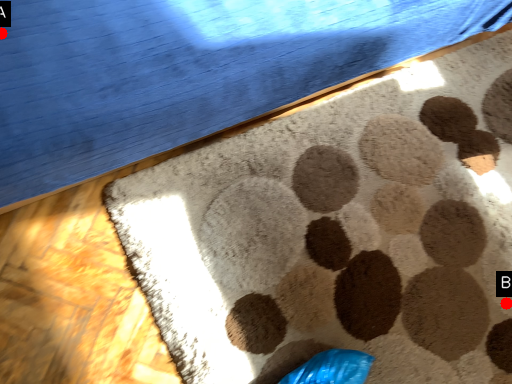
Question: Two points are circled on the image, labeled by A and B beside each circle. Which point is closer to the camera?

Choices:
 (A) A is closer
 (B) B is closer

Answer: (A)